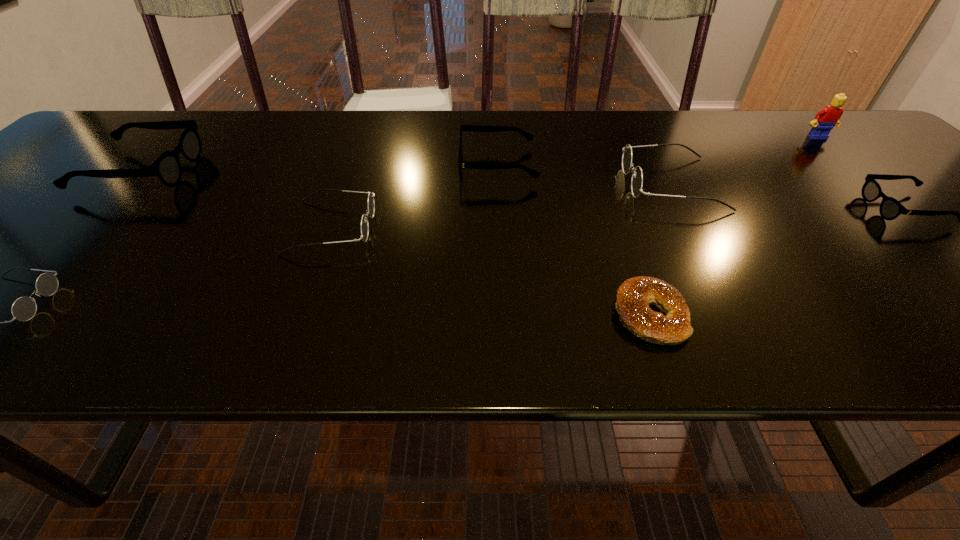
Find the location of `object that is at the far left corner`. object that is at the far left corner is located at coordinates (167, 167).

Locate an element on the screen. This screenshot has width=960, height=540. object present at the far right corner is located at coordinates (827, 118).

This screenshot has height=540, width=960. I want to click on free location at the far edge, so click(x=331, y=152).

Find the location of `vacant area at the far left corner`. vacant area at the far left corner is located at coordinates (138, 143).

This screenshot has width=960, height=540. Identify the location of vacant region at the far right corner. (864, 141).

Where is `unoccupied area between the third object from left to right and the biggest black spectacles`? The height and width of the screenshot is (540, 960). unoccupied area between the third object from left to right and the biggest black spectacles is located at coordinates (236, 199).

The image size is (960, 540). In order to click on free space that is in between the second spectacles from right to left and the farthest object in this screenshot , I will do `click(744, 160)`.

The width and height of the screenshot is (960, 540). I want to click on vacant point located between the rightmost dark spectacles and the bagel, so tap(660, 249).

This screenshot has height=540, width=960. What are the coordinates of `empty space that is in between the rightmost spectacles and the farthest object` in the screenshot? It's located at (861, 173).

Where is `free space between the rightmost dark spectacles and the rightmost spectacles`? free space between the rightmost dark spectacles and the rightmost spectacles is located at coordinates (788, 196).